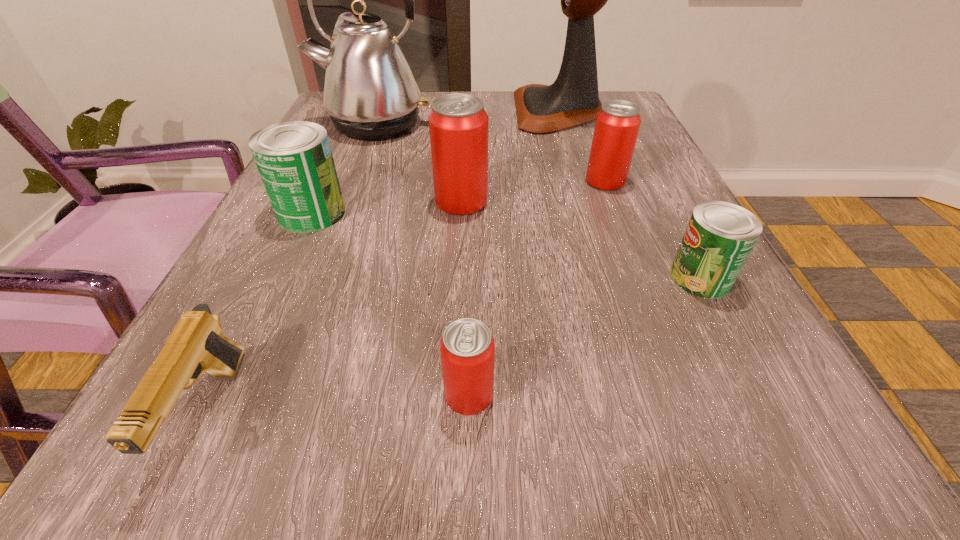
Locate an element on the screen. vacant space located 0.250m on the right of the left green can is located at coordinates (488, 213).

I want to click on free space located 0.170m on the left of the nearer green can, so click(558, 278).

Where is `free region located on the back of the nearest red can`? free region located on the back of the nearest red can is located at coordinates (471, 291).

The image size is (960, 540). I want to click on fan present at the far edge, so click(573, 99).

The height and width of the screenshot is (540, 960). I want to click on kettle that is at the far edge, so click(x=370, y=92).

You are a GUI agent. You are given a task and a screenshot of the screen. Output one action in this format:
    pyautogui.click(x=<x>, y=<y>)
    Task: Click on the object that is at the near edge
    This screenshot has width=960, height=540.
    Given the screenshot: What is the action you would take?
    196,345

At what (x,y) coordinates should I click in order to perform the action: click on kettle present at the left edge. Please return your answer as a coordinate pair (x, y). Looking at the image, I should click on (370, 92).

Where is `can present at the left edge`? can present at the left edge is located at coordinates (294, 159).

Image resolution: width=960 pixels, height=540 pixels. What are the coordinates of `pistol situated at the left edge` in the screenshot? It's located at (196, 345).

At what (x,y) coordinates should I click in order to perform the action: click on fan positioned at the right edge. Please return your answer as a coordinate pair (x, y). The width and height of the screenshot is (960, 540). Looking at the image, I should click on (573, 99).